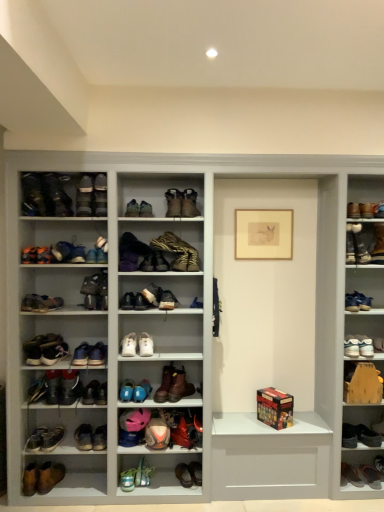
Find the location of a particular element. The height and width of the screenshot is (512, 384). vacant region above wooden shelf at right (from a real-world perspective) is located at coordinates (370, 355).